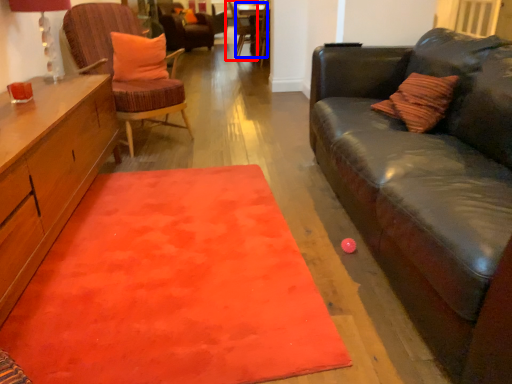
Question: Which object appears closest to the camera in this image, chair (highlighted by a red box) or side table (highlighted by a blue box)?

Choices:
 (A) chair
 (B) side table

Answer: (B)